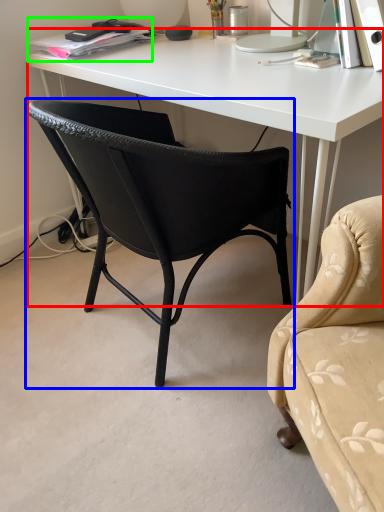
Question: Considering the real-world distances, which object is farthest from desk (highlighted by a red box)? chair (highlighted by a blue box) or book (highlighted by a green box)?

Choices:
 (A) chair
 (B) book

Answer: (B)